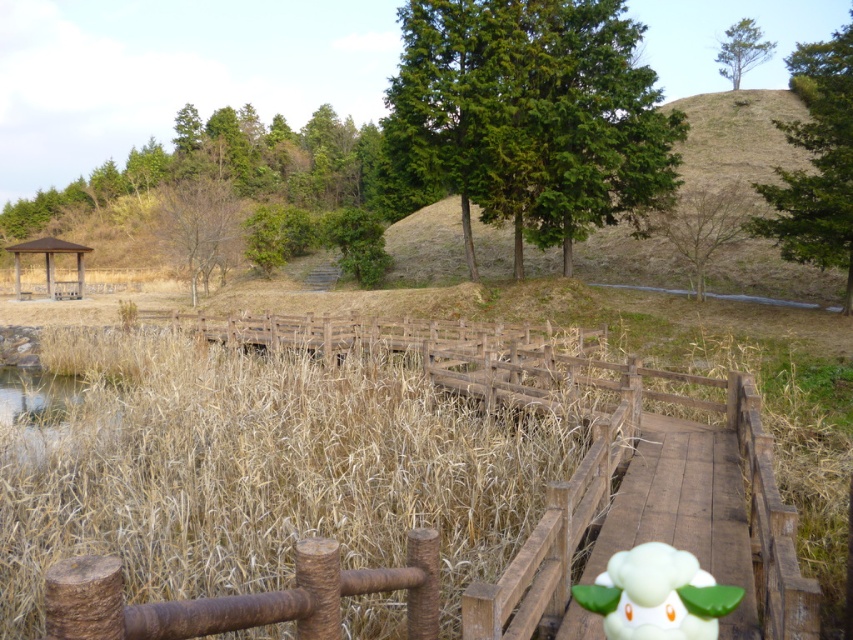
Can you confirm if dry grass at center is bigger than brown wooden gazebo at left?

No, dry grass at center is not bigger than brown wooden gazebo at left.

At what (x,y) coordinates should I click in order to perform the action: click on dry grass at center. Please return your answer as a coordinate pair (x, y). Looking at the image, I should click on (254, 468).

Between point (463, 419) and point (82, 268), which one is positioned in front?

Positioned in front is point (463, 419).

I want to click on dry grass at center, so click(254, 468).

Between white matte plush toy at center and brown wooden gazebo at left, which one appears on the left side from the viewer's perspective?

brown wooden gazebo at left is more to the left.

Is white matte plush toy at center closer to camera compared to brown wooden gazebo at left?

Yes, white matte plush toy at center is closer to the viewer.

This screenshot has height=640, width=853. What do you see at coordinates (657, 595) in the screenshot? I see `white matte plush toy at center` at bounding box center [657, 595].

Locate an element on the screen. white matte plush toy at center is located at coordinates (657, 595).

What do you see at coordinates (254, 468) in the screenshot?
I see `dry grass at center` at bounding box center [254, 468].

Is dry grass at center thinner than white matte plush toy at center?

No.

Describe the element at coordinates (254, 468) in the screenshot. The height and width of the screenshot is (640, 853). I see `dry grass at center` at that location.

Where is `dry grass at center`? The width and height of the screenshot is (853, 640). dry grass at center is located at coordinates (254, 468).